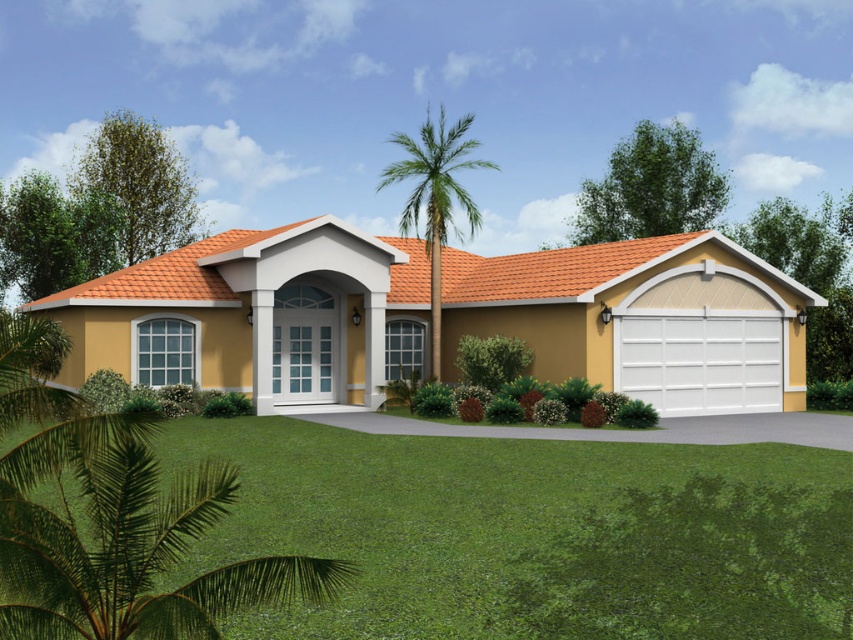
Question: Does green grass at lower center come behind green leafy palm tree at center?

Choices:
 (A) yes
 (B) no

Answer: (B)

Question: Does green grass at lower center appear over white textured garage door at lower right?

Choices:
 (A) no
 (B) yes

Answer: (A)

Question: Based on their relative distances, which object is farther from the green grass at lower center?

Choices:
 (A) white textured garage door at center
 (B) white textured garage door at lower right

Answer: (B)

Question: Can you confirm if white textured garage door at lower right is positioned above green leafy palm tree at center?

Choices:
 (A) no
 (B) yes

Answer: (A)

Question: Which point is closer to the camera taking this photo?

Choices:
 (A) 780,368
 (B) 437,278
 (C) 511,545

Answer: (C)

Question: Which object is positioned farthest from the green grass at lower center?

Choices:
 (A) white textured garage door at center
 (B) white textured garage door at lower right
 (C) green leafy palm tree at center

Answer: (C)